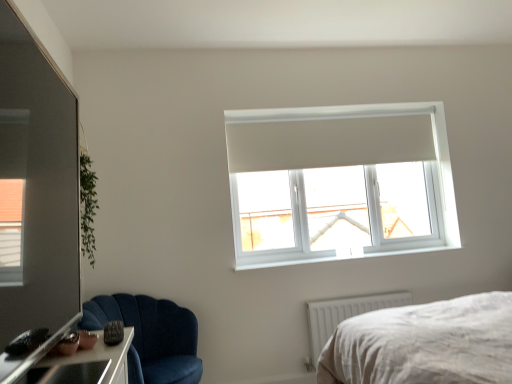
You are a GUI agent. You are given a task and a screenshot of the screen. Output one action in this format:
    pyautogui.click(x=<x>, y=<y>)
    Task: Click on the vacant area on top of white plastic radiator at lower right (from a real-world perspective)
    This screenshot has width=512, height=384.
    Given the screenshot: What is the action you would take?
    pyautogui.click(x=360, y=292)